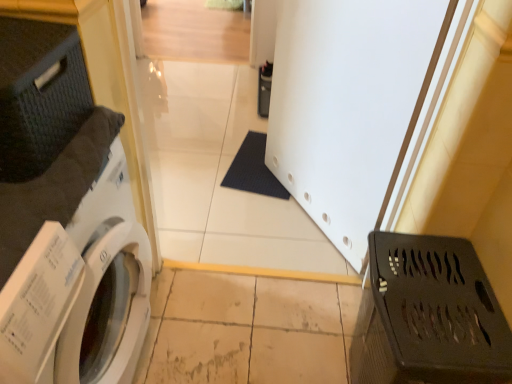
Question: Do you think white matte screen door at center is within black plastic laundry basket at lower right, or outside of it?

Choices:
 (A) outside
 (B) inside

Answer: (A)

Question: From the image's perspective, is white matte screen door at center above or below black plastic laundry basket at lower right?

Choices:
 (A) above
 (B) below

Answer: (A)

Question: Considering the real-world distances, which object is closest to the white matte screen door at center?

Choices:
 (A) white glossy washing machine at left
 (B) black plastic laundry basket at lower right

Answer: (B)

Question: Which object is the closest to the white matte screen door at center?

Choices:
 (A) black plastic laundry basket at lower right
 (B) white glossy washing machine at left

Answer: (A)